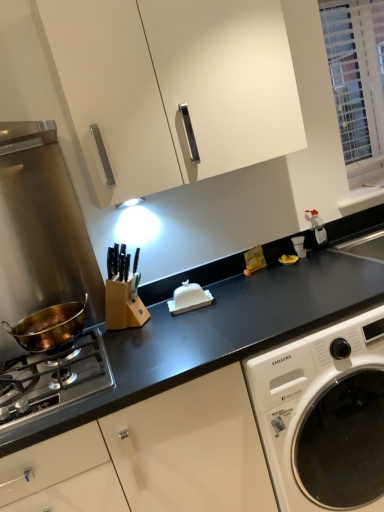
Locate an element on the screen. Image resolution: width=384 pixels, height=512 pixels. empty space that is ontop of white glossy washing machine at lower right (from a real-world perspective) is located at coordinates (285, 292).